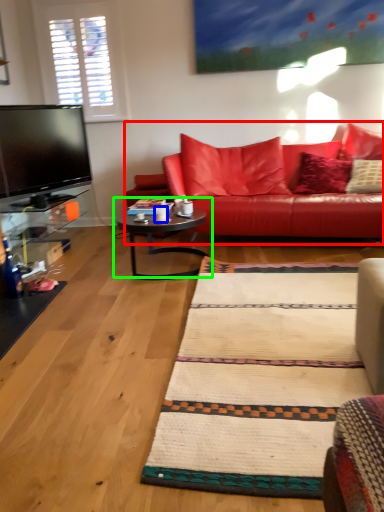
Question: Based on their relative distances, which object is farther from studio couch (highlighted by a red box)? Choose from coffee cup (highlighted by a blue box) and coffee table (highlighted by a green box).

Choices:
 (A) coffee cup
 (B) coffee table

Answer: (A)